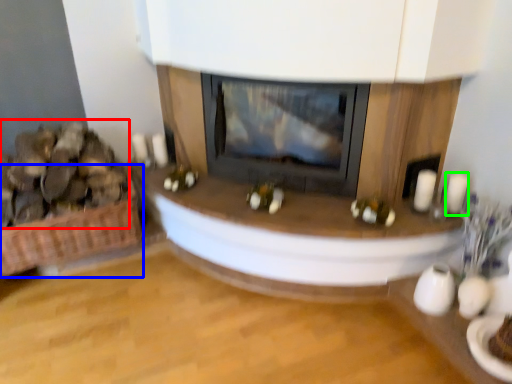
Question: Which is nearer to the food (highlighted by a red box)? basket (highlighted by a blue box) or candle (highlighted by a green box).

Choices:
 (A) basket
 (B) candle

Answer: (A)